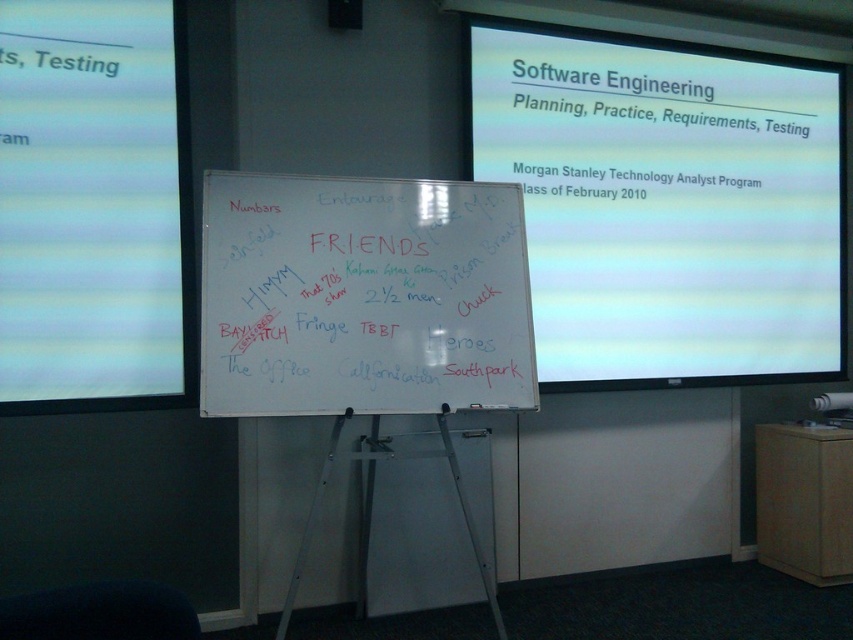
Consider the image. Does white matte projection screen at upper left have a larger size compared to whiteboard at center?

No.

Between point (111, 292) and point (380, 358), which one is positioned behind?

The point (111, 292) is behind.

Identify the location of white matte projection screen at upper left. This screenshot has height=640, width=853. (96, 205).

Does white glossy projector screen at upper center appear over white matte projection screen at upper left?

Answer: Correct, white glossy projector screen at upper center is located above white matte projection screen at upper left.

Image resolution: width=853 pixels, height=640 pixels. Find the location of `white glossy projector screen at upper center`. white glossy projector screen at upper center is located at coordinates (666, 204).

Is point (563, 120) positioned in front of point (134, 404)?

No, (563, 120) is further to viewer.

In order to click on white glossy projector screen at upper center in this screenshot , I will do `click(666, 204)`.

The height and width of the screenshot is (640, 853). In order to click on white glossy projector screen at upper center in this screenshot , I will do `click(666, 204)`.

Between white glossy projector screen at upper center and whiteboard at center, which one appears on the left side from the viewer's perspective?

whiteboard at center is more to the left.

Identify the location of white glossy projector screen at upper center. (666, 204).